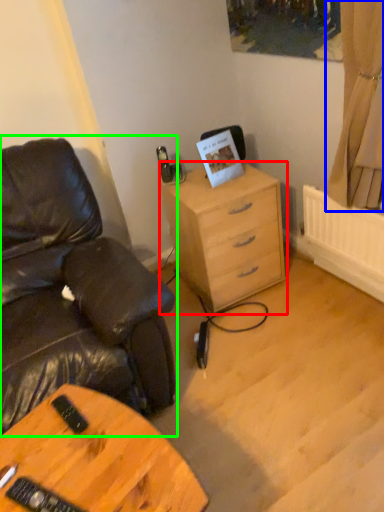
Question: Which object is positioned farthest from chest of drawers (highlighted by a red box)? Select from curtain (highlighted by a blue box) and chair (highlighted by a green box).

Choices:
 (A) curtain
 (B) chair

Answer: (B)